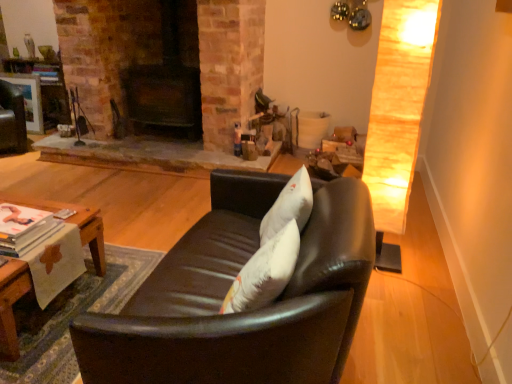
Question: Is woodenwoodentable at lower left at the right side of black leather couch at center?

Choices:
 (A) yes
 (B) no

Answer: (B)

Question: Can you confirm if woodenwoodentable at lower left is wider than black leather couch at center?

Choices:
 (A) yes
 (B) no

Answer: (B)

Question: Is woodenwoodentable at lower left surrounding black leather couch at center?

Choices:
 (A) yes
 (B) no

Answer: (B)

Question: Would you consider woodenwoodentable at lower left to be distant from black leather couch at center?

Choices:
 (A) yes
 (B) no

Answer: (B)

Question: Does woodenwoodentable at lower left have a greater height compared to black leather couch at center?

Choices:
 (A) yes
 (B) no

Answer: (B)

Question: From the image's perspective, is woodenwoodentable at lower left below black leather couch at center?

Choices:
 (A) yes
 (B) no

Answer: (A)

Question: From a real-world perspective, is black leather couch at center physically above matte black swivel chair at upper left?

Choices:
 (A) yes
 (B) no

Answer: (A)

Question: Is black leather couch at center bigger than matte black swivel chair at upper left?

Choices:
 (A) yes
 (B) no

Answer: (A)

Question: Could matte black swivel chair at upper left be considered to be inside black leather couch at center?

Choices:
 (A) no
 (B) yes

Answer: (A)

Question: Can you confirm if black leather couch at center is shorter than matte black swivel chair at upper left?

Choices:
 (A) no
 (B) yes

Answer: (A)

Question: Considering the relative positions of black leather couch at center and matte black swivel chair at upper left in the image provided, is black leather couch at center to the right of matte black swivel chair at upper left from the viewer's perspective?

Choices:
 (A) no
 (B) yes

Answer: (B)

Question: Would you say black leather couch at center is outside matte black swivel chair at upper left?

Choices:
 (A) yes
 (B) no

Answer: (A)

Question: From the image's perspective, does black leather couch at center appear higher than woodenwoodentable at lower left?

Choices:
 (A) no
 (B) yes

Answer: (B)